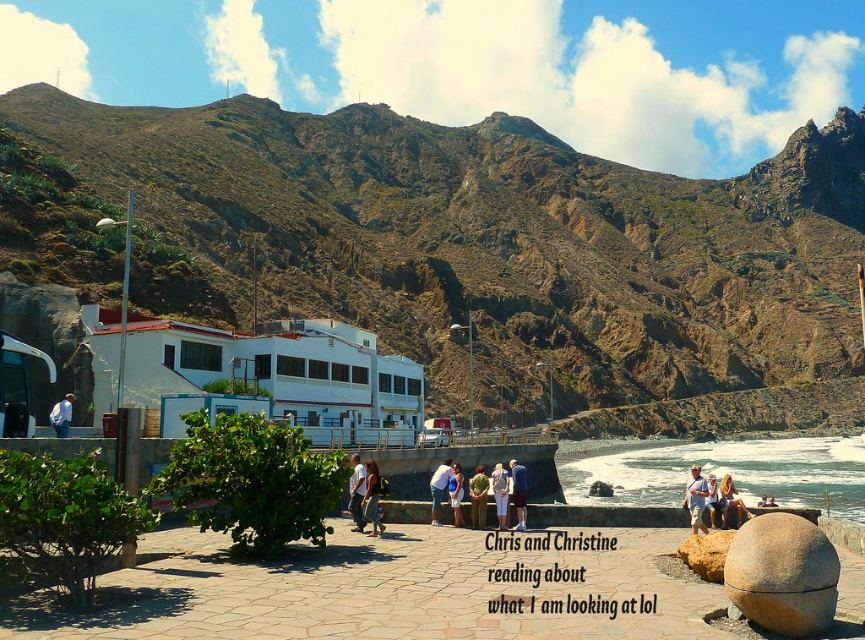
You are a photographer aiming to capture the white matte building at center and the light blue denim shorts at lower right in a single frame. Based on their positions, which object should you focus on first to ensure both are in the shot?

The white matte building at center is positioned on the left side of light blue denim shorts at lower right. To capture both in a single frame, focus on the white matte building at center first as it is further away and adjust the camera angle to include the light blue denim shorts at lower right on the right side.

You are a photographer standing on the walkway and want to capture both the light blue denim shorts at lower right and the light blue denim jeans at center in the same frame. Which direction should you move to ensure both are visible?

You should move to the left so that both the light blue denim shorts at lower right and the light blue denim jeans at center are visible in your frame since the light blue denim shorts at lower right is to the right of the light blue denim jeans at center.